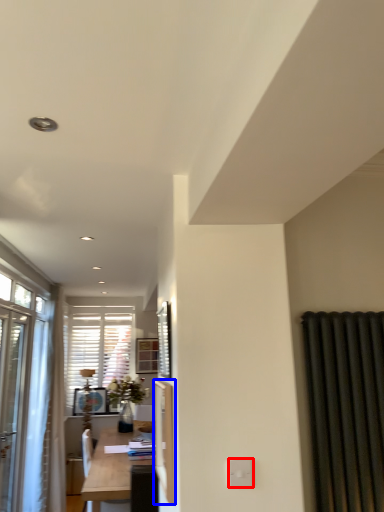
Question: Which of the following is the farthest to the observer, electric outlet (highlighted by a red box) or screen door (highlighted by a blue box)?

Choices:
 (A) electric outlet
 (B) screen door

Answer: (B)